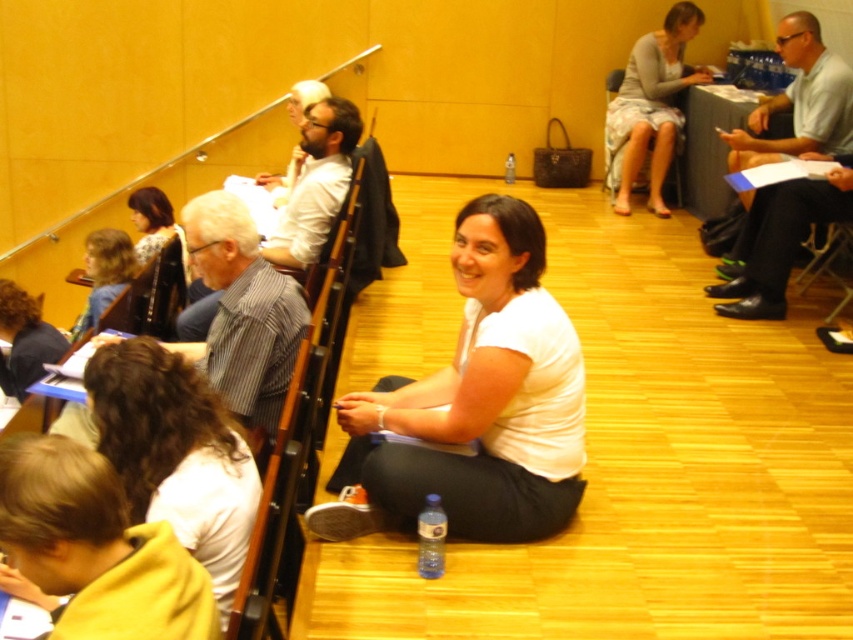
Can you confirm if blonde hair at lower left is taller than matte black jacket at upper left?

In fact, blonde hair at lower left may be shorter than matte black jacket at upper left.

Can you confirm if blonde hair at lower left is positioned above matte black jacket at upper left?

No, blonde hair at lower left is not above matte black jacket at upper left.

Locate an element on the screen. This screenshot has height=640, width=853. blonde hair at lower left is located at coordinates (105, 273).

Find the location of a particular element. Image resolution: width=853 pixels, height=640 pixels. blonde hair at lower left is located at coordinates (105, 273).

Does light gray textured sweater at upper right appear under matte black jacket at upper left?

No, light gray textured sweater at upper right is not below matte black jacket at upper left.

Is light gray textured sweater at upper right positioned in front of matte black jacket at upper left?

No, light gray textured sweater at upper right is behind matte black jacket at upper left.

Does point (651, 67) come closer to viewer compared to point (138, 209)?

That is False.

The width and height of the screenshot is (853, 640). I want to click on light gray textured sweater at upper right, so click(653, 104).

Can you confirm if white fabric shirt at lower left is smaller than light gray textured sweater at upper right?

Yes.

Is point (202, 472) farther from viewer compared to point (688, 83)?

No, it is in front of (688, 83).

Locate an element on the screen. The width and height of the screenshot is (853, 640). white fabric shirt at lower left is located at coordinates (177, 452).